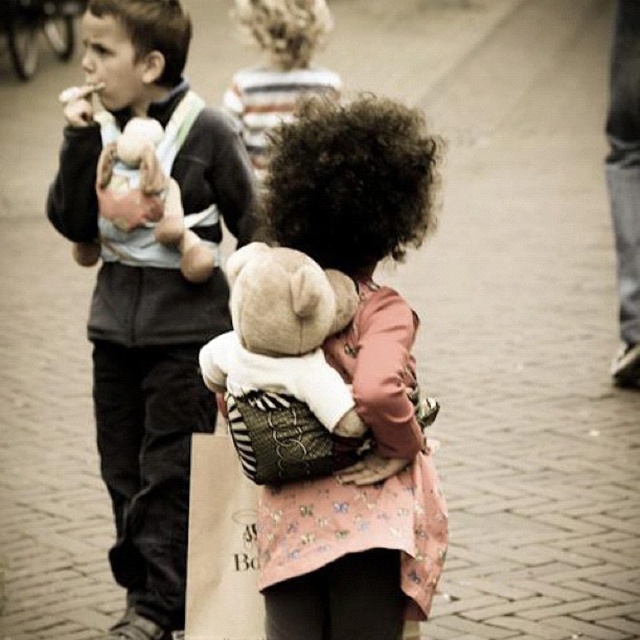
Question: Does matte black jacket at left appear under fluffy beige teddy bear at center?

Choices:
 (A) yes
 (B) no

Answer: (B)

Question: Which object appears farthest from the camera in this image?

Choices:
 (A) matte black jacket at left
 (B) fluffy beige teddy bear at center

Answer: (A)

Question: Is matte black jacket at left thinner than fluffy pink sweater at center?

Choices:
 (A) yes
 (B) no

Answer: (B)

Question: Does matte black jacket at left have a greater width compared to fluffy pink sweater at center?

Choices:
 (A) yes
 (B) no

Answer: (A)

Question: Which object is the closest to the fluffy pink sweater at center?

Choices:
 (A) matte black jacket at left
 (B) fluffy beige teddy bear at center

Answer: (B)

Question: Which object appears closest to the camera in this image?

Choices:
 (A) matte black jacket at left
 (B) fluffy pink sweater at center

Answer: (B)